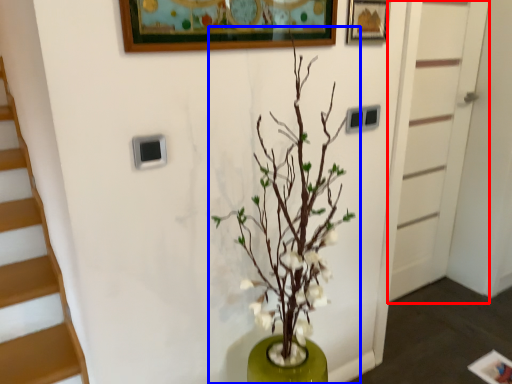
Question: Among these objects, which one is nearest to the camera, door (highlighted by a red box) or houseplant (highlighted by a blue box)?

Choices:
 (A) door
 (B) houseplant

Answer: (B)